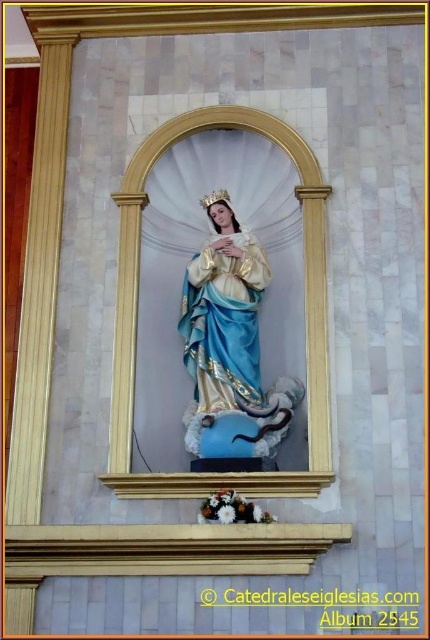
Question: Is matte gold statue at center positioned at the back of blue satin dress at center?

Choices:
 (A) yes
 (B) no

Answer: (B)

Question: Can you confirm if matte gold statue at center is positioned to the left of blue satin dress at center?

Choices:
 (A) yes
 (B) no

Answer: (B)

Question: Which point is farther from the camera taking this photo?

Choices:
 (A) (221, 298)
 (B) (254, 264)

Answer: (B)

Question: From the image, what is the correct spatial relationship of matte gold statue at center in relation to blue satin dress at center?

Choices:
 (A) right
 (B) left

Answer: (A)